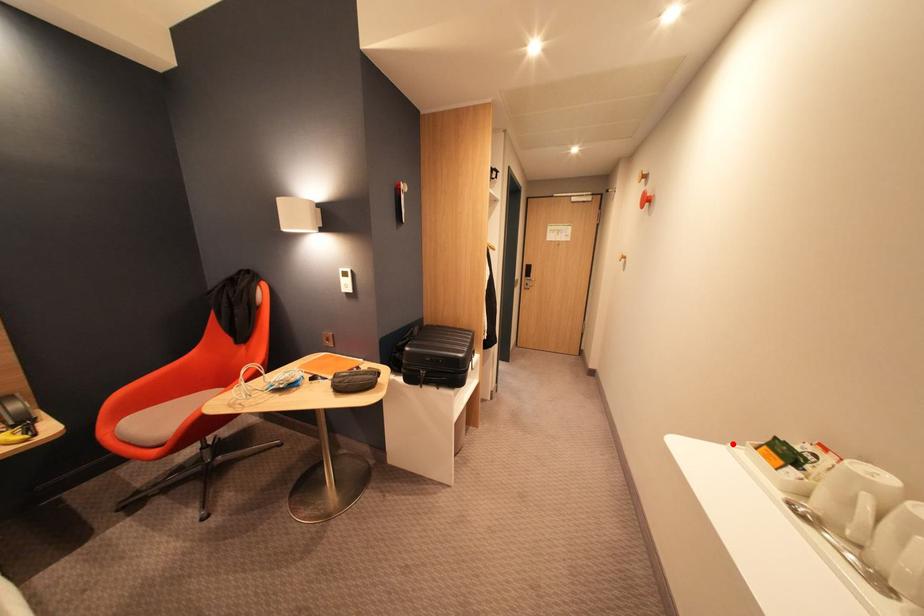
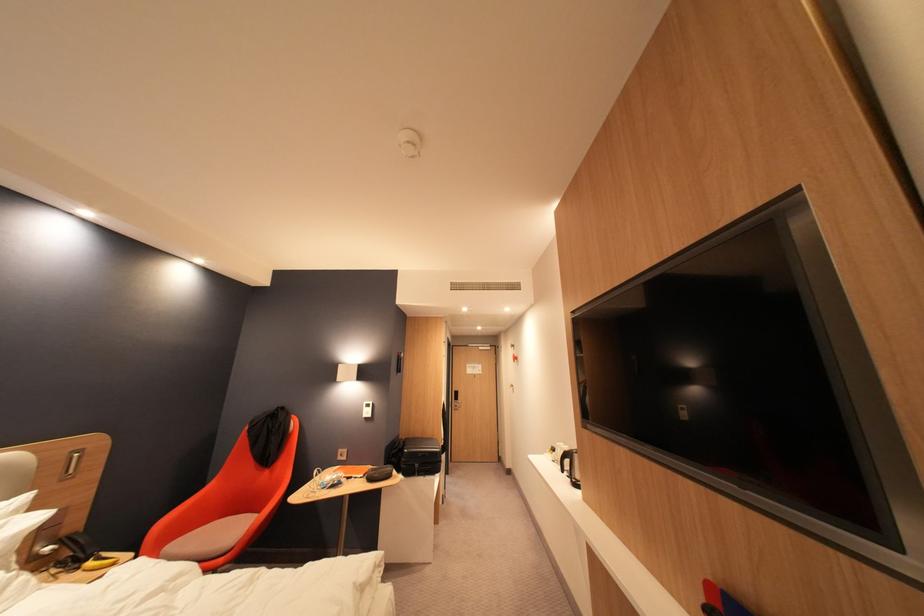
The point at the highlighted location is marked in the first image. Where is the corresponding point in the second image?

(553, 455)